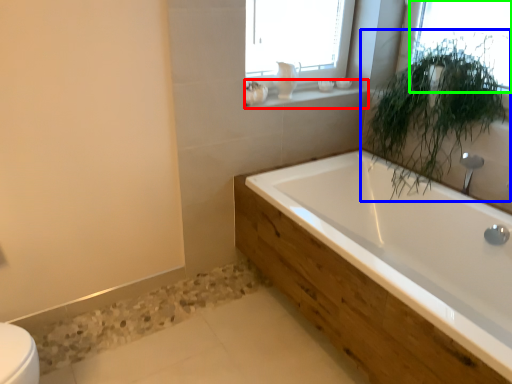
Question: Considering the real-world distances, which object is farthest from window sill (highlighted by a red box)? houseplant (highlighted by a blue box) or window (highlighted by a green box)?

Choices:
 (A) houseplant
 (B) window

Answer: (B)